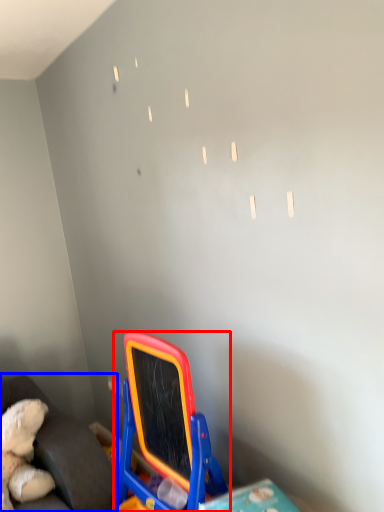
Question: Which point is further to the camera, toy (highlighted by a red box) or furniture (highlighted by a blue box)?

Choices:
 (A) toy
 (B) furniture

Answer: (B)